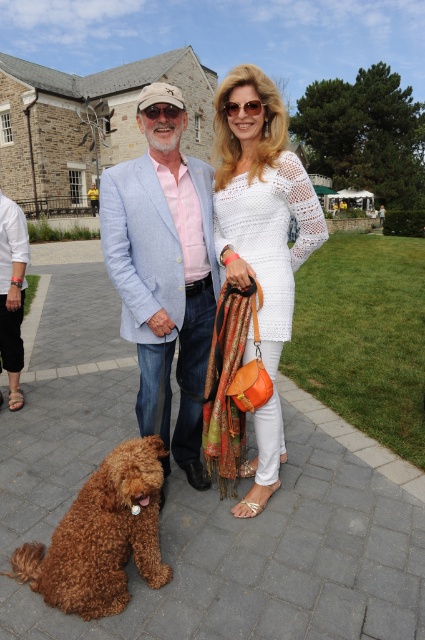
You are a photographer trying to capture the light blue textured blazer at center and the brown fluffy dog at lower left in the same frame. Which object should you focus on first to ensure both are in the frame without moving the camera?

The light blue textured blazer at center is bigger than the brown fluffy dog at lower left, so you should focus on the brown fluffy dog at lower left first to ensure both fit in the frame.